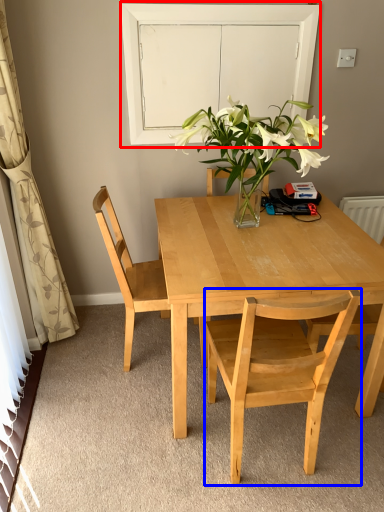
Question: Which of the following is the closest to the observer, glass door (highlighted by a red box) or chair (highlighted by a blue box)?

Choices:
 (A) glass door
 (B) chair

Answer: (B)